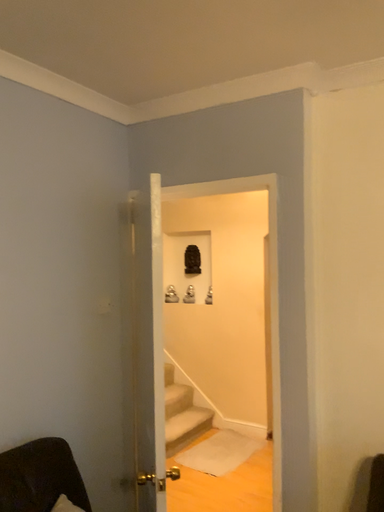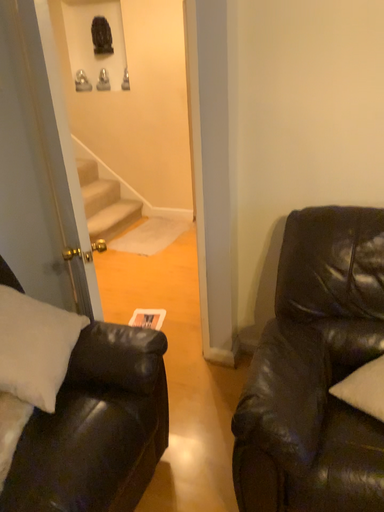
Question: How did the camera likely rotate when shooting the video?

Choices:
 (A) rotated right
 (B) rotated left

Answer: (A)